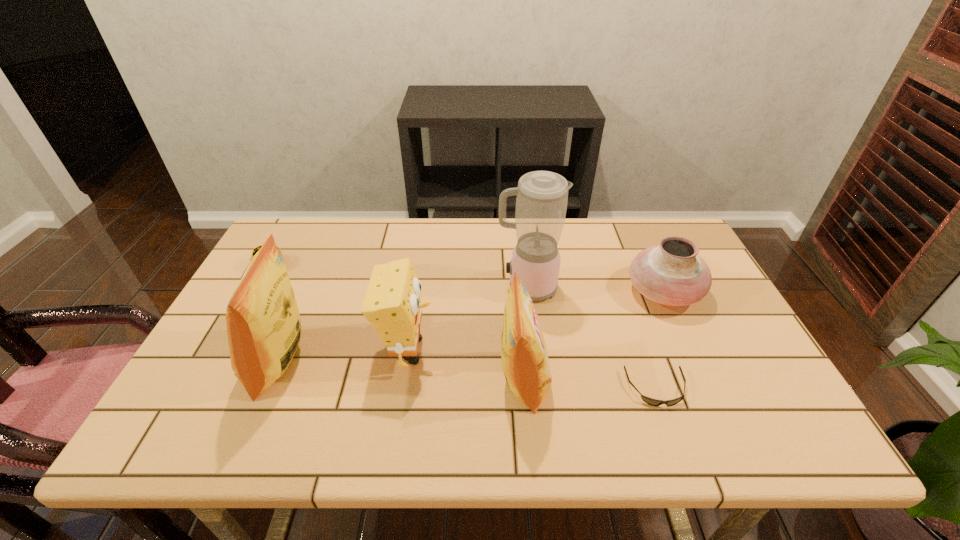
You are a GUI agent. You are given a task and a screenshot of the screen. Output one action in this format:
    pyautogui.click(x=<x>, y=<y>)
    Task: Click on the sponge that is at the near edge
    Image resolution: width=960 pixels, height=540 pixels.
    Given the screenshot: What is the action you would take?
    pyautogui.click(x=392, y=304)

Locate an element on the screen. sunglasses at the near edge is located at coordinates (653, 402).

Image resolution: width=960 pixels, height=540 pixels. I want to click on crisp (potato chip) that is at the left edge, so click(263, 323).

Where is `patty located at the left edge`? The height and width of the screenshot is (540, 960). patty located at the left edge is located at coordinates (256, 249).

In order to click on object at the right edge in this screenshot , I will do `click(671, 273)`.

Find the location of a particular element. object present at the far left corner is located at coordinates (256, 249).

Locate an element on the screen. The height and width of the screenshot is (540, 960). object present at the near left corner is located at coordinates (263, 323).

Find the location of `free space at the far edge of the desktop`. free space at the far edge of the desktop is located at coordinates (447, 241).

Identify the location of vacant space at the near edge of the desktop. The height and width of the screenshot is (540, 960). (682, 390).

In the image, there is a desktop. Where is `free region at the right edge`? free region at the right edge is located at coordinates 727,349.